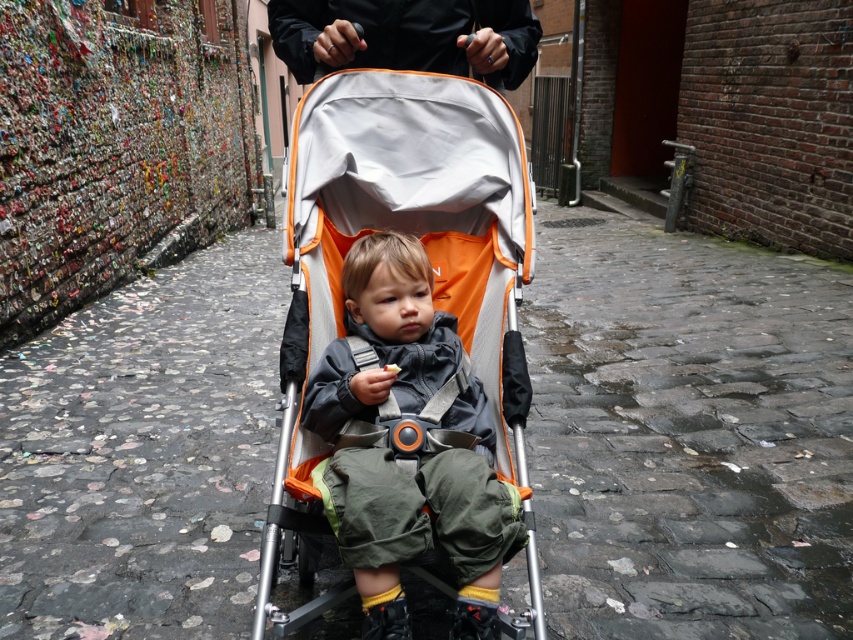
Question: Is orange fabric baby carriage at center thinner than black matte jacket at upper center?

Choices:
 (A) no
 (B) yes

Answer: (B)

Question: Is orange fabric baby carriage at center below black matte jacket at upper center?

Choices:
 (A) no
 (B) yes

Answer: (B)

Question: Among these points, which one is nearest to the camera?

Choices:
 (A) (521, 484)
 (B) (276, 20)

Answer: (A)

Question: Can you confirm if orange fabric baby carriage at center is positioned above black matte jacket at upper center?

Choices:
 (A) yes
 (B) no

Answer: (B)

Question: Which of the following is the farthest from the observer?

Choices:
 (A) (462, 140)
 (B) (521, 28)

Answer: (B)